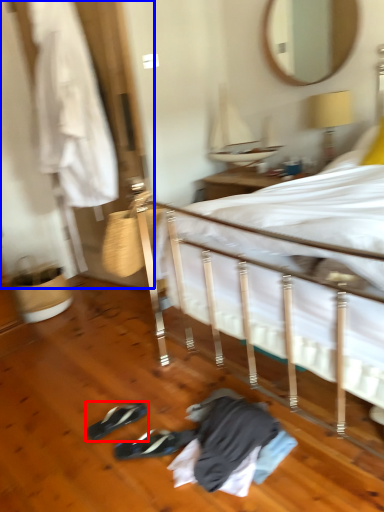
Question: Which point is further to the camera, footwear (highlighted by a red box) or closet (highlighted by a blue box)?

Choices:
 (A) footwear
 (B) closet

Answer: (B)